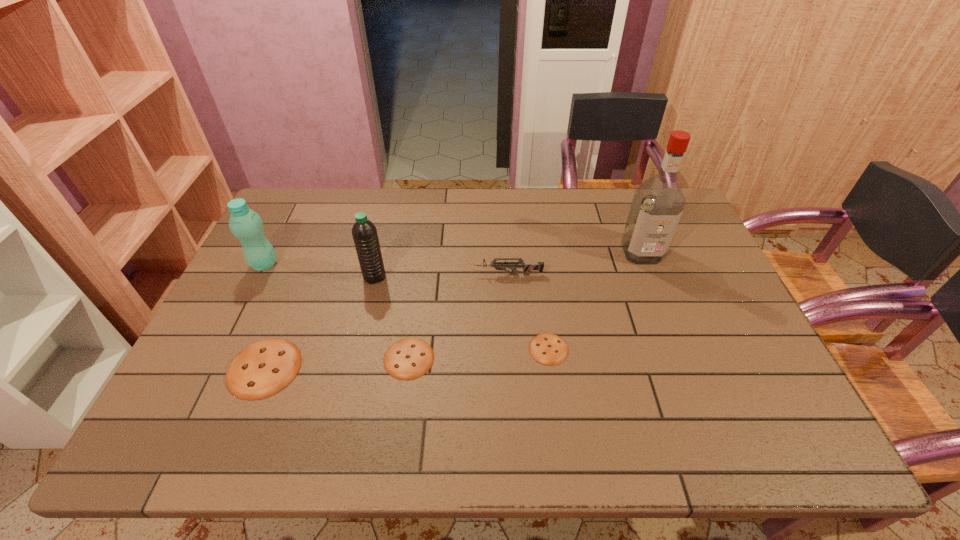
Image resolution: width=960 pixels, height=540 pixels. Identify the location of object that can be found as the second closest to the third object from left to right. (264, 368).

Locate an element on the screen. The width and height of the screenshot is (960, 540). cookie that stands as the closest to the bottle is located at coordinates (264, 368).

The image size is (960, 540). I want to click on cookie that stands as the closest to the fourth object from right to left, so click(x=264, y=368).

Locate an element on the screen. The height and width of the screenshot is (540, 960). free region that satisfies the following two spatial constraints: 1. on the front side of the fourth object from right to left; 2. on the left side of the water bottle is located at coordinates (355, 359).

The image size is (960, 540). What are the coordinates of `free space that satisfies the following two spatial constraints: 1. on the front-facing side of the liquor; 2. aimed along the barrel of the fourth tallest object` in the screenshot? It's located at (650, 274).

Identify the location of vacant space that satisfies the following two spatial constraints: 1. on the front side of the tallest cookie; 2. on the left side of the bottle. (212, 368).

At what (x,y) coordinates should I click in order to perform the action: click on vacant space that satisfies the following two spatial constraints: 1. on the back side of the fourth object from left to right; 2. on the right side of the shortest cookie. Please return your answer as a coordinate pair (x, y). This screenshot has height=540, width=960. Looking at the image, I should click on (410, 349).